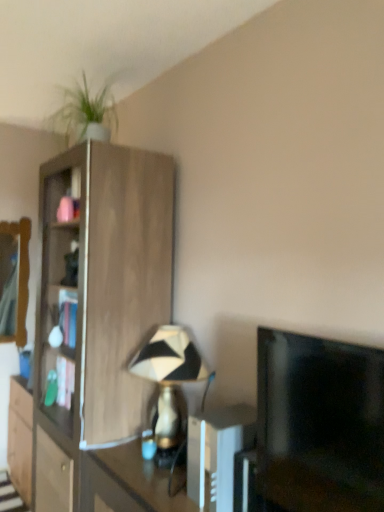
Question: Considering the relative sizes of black glossy tv at right and white plastic remote control at center in the image provided, is black glossy tv at right bigger than white plastic remote control at center?

Choices:
 (A) yes
 (B) no

Answer: (A)

Question: Does black glossy tv at right have a greater width compared to white plastic remote control at center?

Choices:
 (A) no
 (B) yes

Answer: (A)

Question: Does black glossy tv at right have a lesser height compared to white plastic remote control at center?

Choices:
 (A) yes
 (B) no

Answer: (B)

Question: From a real-world perspective, is black glossy tv at right on top of white plastic remote control at center?

Choices:
 (A) yes
 (B) no

Answer: (A)

Question: Is black glossy tv at right oriented towards white plastic remote control at center?

Choices:
 (A) yes
 (B) no

Answer: (B)

Question: Considering the positions of black and white geometric lampshade at center and white plastic remote control at center in the image, is black and white geometric lampshade at center wider or thinner than white plastic remote control at center?

Choices:
 (A) wide
 (B) thin

Answer: (B)

Question: Is black and white geometric lampshade at center in front of or behind white plastic remote control at center in the image?

Choices:
 (A) front
 (B) behind

Answer: (B)

Question: Does point (145, 357) appear closer or farther from the camera than point (221, 454)?

Choices:
 (A) closer
 (B) farther

Answer: (B)

Question: Is black and white geometric lampshade at center inside the boundaries of white plastic remote control at center, or outside?

Choices:
 (A) inside
 (B) outside

Answer: (B)

Question: Is white plastic remote control at center inside or outside of black glossy tv at right?

Choices:
 (A) inside
 (B) outside

Answer: (B)

Question: Would you say white plastic remote control at center is to the left or to the right of black glossy tv at right in the picture?

Choices:
 (A) right
 (B) left

Answer: (B)

Question: Looking at the image, does white plastic remote control at center seem bigger or smaller compared to black glossy tv at right?

Choices:
 (A) big
 (B) small

Answer: (B)

Question: In terms of height, does white plastic remote control at center look taller or shorter compared to black glossy tv at right?

Choices:
 (A) tall
 (B) short

Answer: (B)

Question: Is black glossy tv at right inside the boundaries of wooden mirror at left, or outside?

Choices:
 (A) outside
 (B) inside

Answer: (A)

Question: From their relative heights in the image, would you say black glossy tv at right is taller or shorter than wooden mirror at left?

Choices:
 (A) short
 (B) tall

Answer: (A)